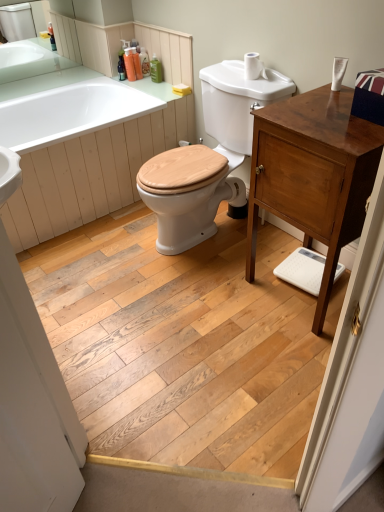
Identify the location of free space above green matte countertop at upper left (from a real-world perspective). (47, 80).